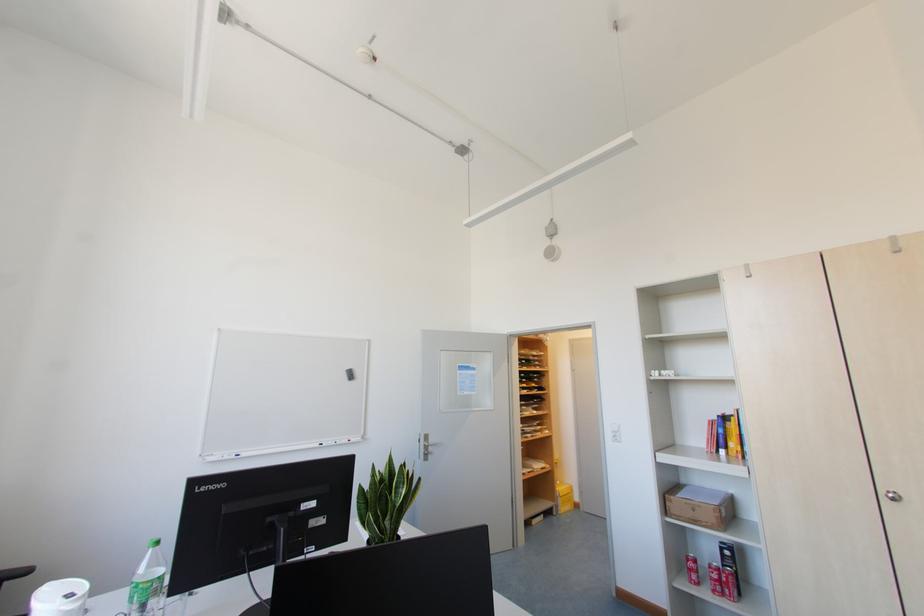
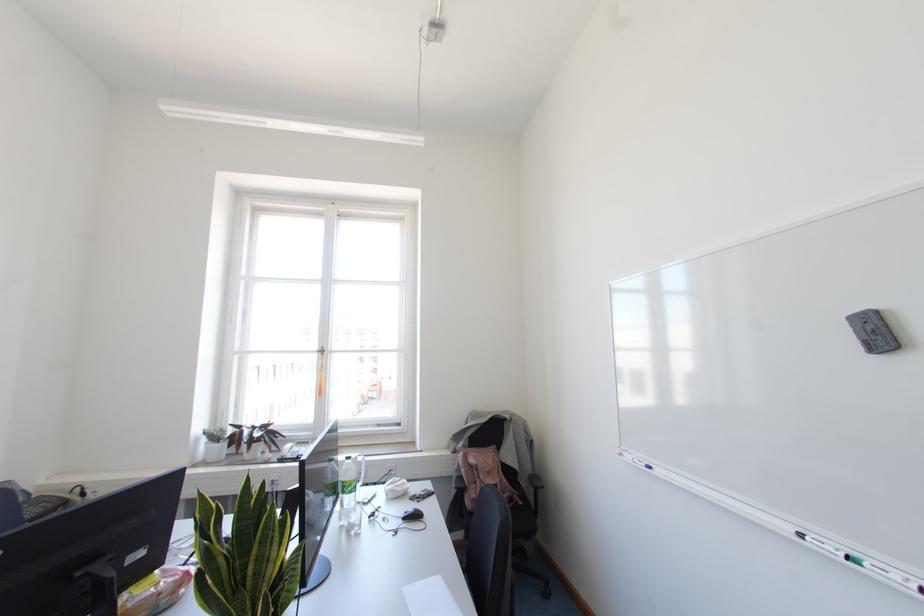
Locate, in the second image, the point that corresponds to (337,440) in the first image.

(866, 565)